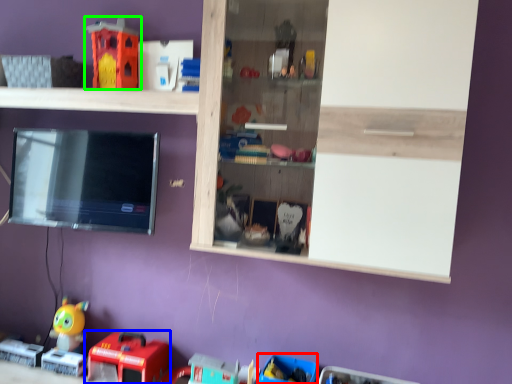
Question: Considering the real-world distances, which object is closest to toy (highlighted by a red box)? toy (highlighted by a blue box) or toy (highlighted by a green box).

Choices:
 (A) toy
 (B) toy

Answer: (A)